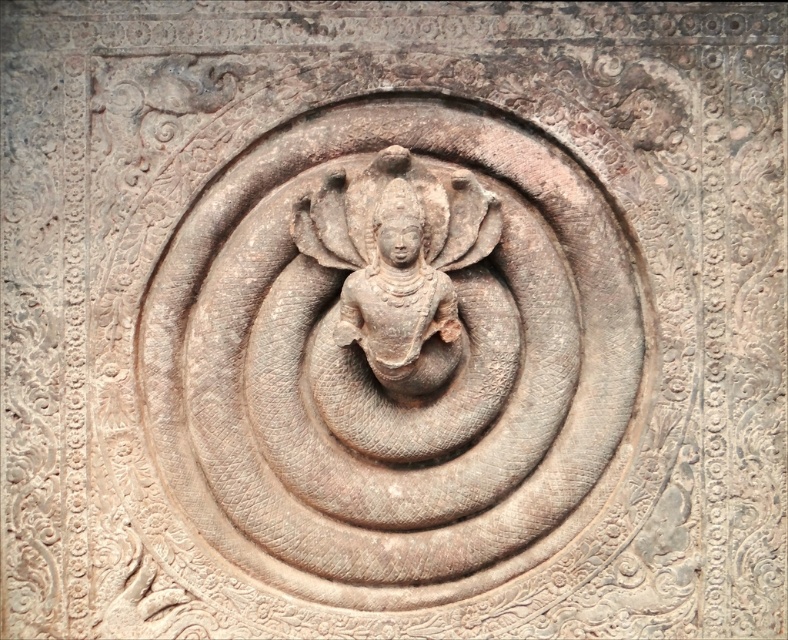
Question: From the image, what is the correct spatial relationship of rustic stone carving at center in relation to rustic stone deity at center?

Choices:
 (A) left
 (B) right

Answer: (A)

Question: Among these objects, which one is nearest to the camera?

Choices:
 (A) rustic stone carving at center
 (B) rustic stone deity at center

Answer: (B)

Question: Does rustic stone carving at center have a lesser width compared to rustic stone deity at center?

Choices:
 (A) yes
 (B) no

Answer: (B)

Question: Which of the following is the farthest from the observer?

Choices:
 (A) (372, 307)
 (B) (497, 509)

Answer: (B)

Question: Can you confirm if rustic stone carving at center is smaller than rustic stone deity at center?

Choices:
 (A) yes
 (B) no

Answer: (B)